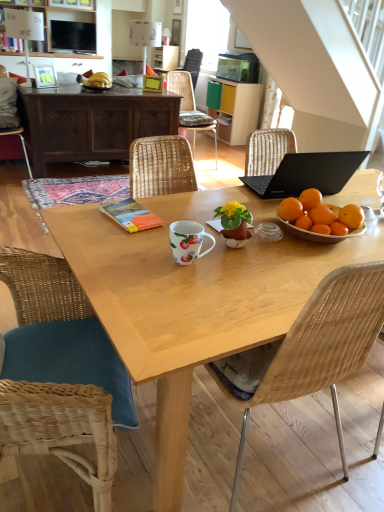
Question: Can you confirm if wooden picture frame at upper center, which is counted as the 4th picture frame, starting from the front, is wider than wooden picture frame at upper left, which ranks as the first picture frame in bottom-to-top order?

Choices:
 (A) no
 (B) yes

Answer: (A)

Question: From a real-world perspective, does wooden picture frame at upper center, which ranks as the 1th picture frame in back-to-front order, sit lower than wooden picture frame at upper left, the fourth picture frame from the top?

Choices:
 (A) no
 (B) yes

Answer: (A)

Question: Can you confirm if wooden picture frame at upper center, which is the 2th picture frame in top-to-bottom order, is smaller than wooden picture frame at upper left, which is the first picture frame from left to right?

Choices:
 (A) no
 (B) yes

Answer: (B)

Question: Are wooden picture frame at upper center, marked as the third picture frame in a left-to-right arrangement, and wooden picture frame at upper left, the fourth picture frame from the top, beside each other?

Choices:
 (A) yes
 (B) no

Answer: (B)

Question: From a real-world perspective, is wooden picture frame at upper center, which is counted as the 4th picture frame, starting from the front, over wooden picture frame at upper left, which ranks as the first picture frame in bottom-to-top order?

Choices:
 (A) no
 (B) yes

Answer: (B)

Question: Is wooden picture frame at upper center, marked as the third picture frame in a left-to-right arrangement, behind wooden picture frame at upper left, which appears as the fourth picture frame when viewed from the back?

Choices:
 (A) yes
 (B) no

Answer: (A)

Question: From the image's perspective, is wooden table at center, positioned as the 1th desk in front-to-back order, over matte black tv at upper left?

Choices:
 (A) yes
 (B) no

Answer: (B)

Question: From the image's perspective, would you say wooden table at center, which is counted as the second desk, starting from the back, is shown under matte black tv at upper left?

Choices:
 (A) no
 (B) yes

Answer: (B)

Question: Is wooden table at center, which is counted as the second desk, starting from the back, closer to the viewer compared to matte black tv at upper left?

Choices:
 (A) no
 (B) yes

Answer: (B)

Question: Is matte black tv at upper left at the back of wooden table at center, acting as the 2th desk starting from the top?

Choices:
 (A) no
 (B) yes

Answer: (A)

Question: Is wooden table at center, positioned as the 1th desk in front-to-back order, beside matte black tv at upper left?

Choices:
 (A) no
 (B) yes

Answer: (A)

Question: Can we say wooden table at center, which is counted as the second desk, starting from the back, lies outside matte black tv at upper left?

Choices:
 (A) no
 (B) yes

Answer: (B)

Question: From a real-world perspective, is wooden woven chair at center, placed as the 3th chair when sorted from left to right, located higher than wooden picture frame at upper left, which ranks as the first picture frame in bottom-to-top order?

Choices:
 (A) yes
 (B) no

Answer: (B)